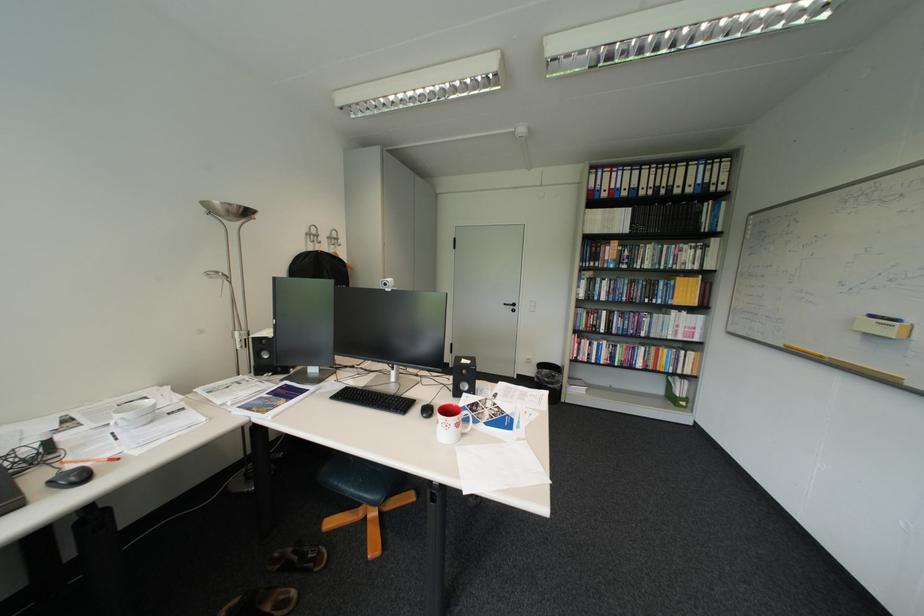
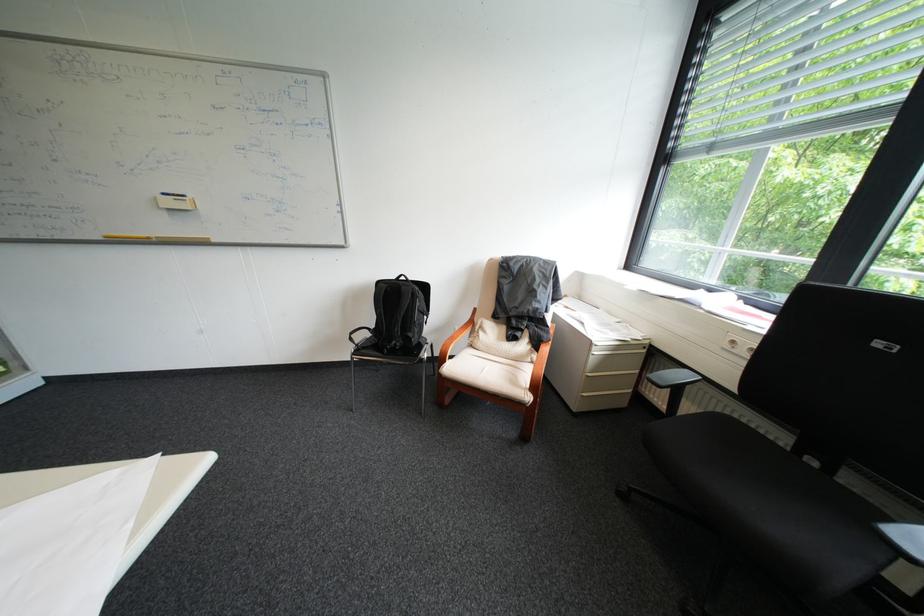
First-person continuous shooting, in which direction is the camera rotating?

The camera rotated toward right-down.